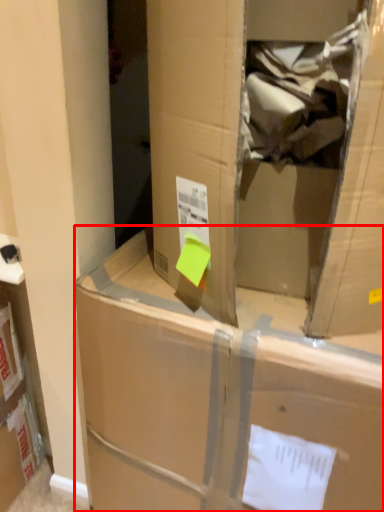
Question: From the image, what is the correct spatial relationship of box (annotated by the red box) in relation to cardboard box?

Choices:
 (A) left
 (B) right

Answer: (A)